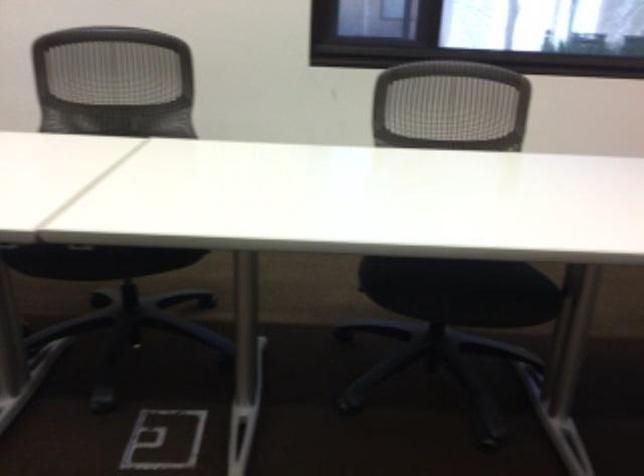
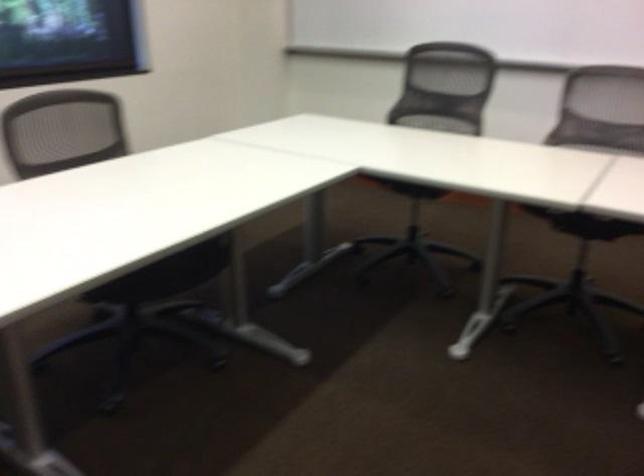
Question: The camera is either moving clockwise (left) or counter-clockwise (right) around the object. The first image is from the beginning of the video and the second image is from the end. Is the camera moving left or right when shooting the video?

Choices:
 (A) Left
 (B) Right

Answer: (A)